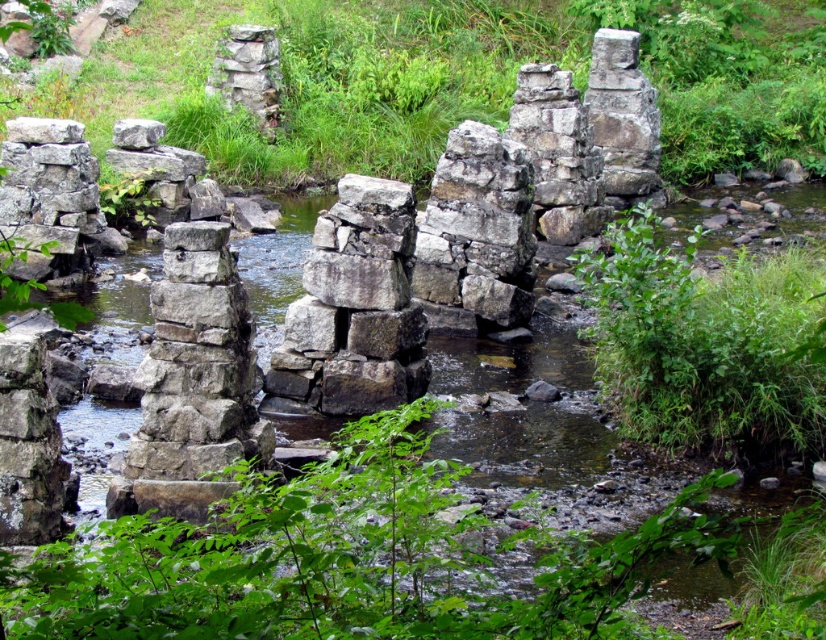
You are a hiker carrying a backpack weighing 20 kilograms. You need to cross the stream shown in the image. The natural stone bridge at center is your only option. Can you safely cross it based on its width compared to the green leafy plant at right?

The natural stone bridge at center might be wider than the green leafy plant at right, so it could support your weight and allow you to cross safely. However, since the width comparison is uncertain, proceed with caution and test the bridge stability before crossing.